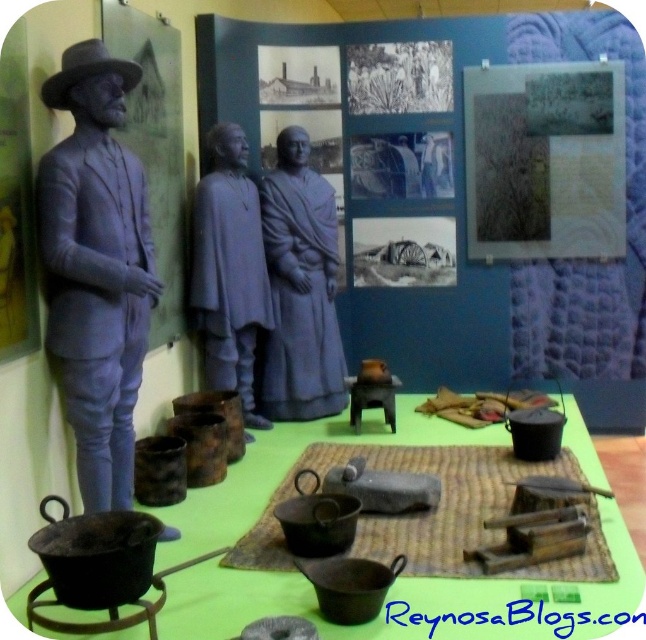
Does matte gray statue at left have a greater height compared to gray matte statue at center?

No.

Describe the element at coordinates (96, 268) in the screenshot. I see `matte gray statue at left` at that location.

At what (x,y) coordinates should I click in order to perform the action: click on matte gray statue at left. Please return your answer as a coordinate pair (x, y). Looking at the image, I should click on (96, 268).

Which is in front, point (275, 272) or point (214, 227)?

Point (214, 227)

Can you confirm if gray matte statue at center is bigger than gray matte statues at center?

No, gray matte statue at center is not bigger than gray matte statues at center.

Between point (284, 273) and point (222, 292), which one is positioned behind?

The point (284, 273) is more distant.

Identify the location of gray matte statue at center. This screenshot has height=640, width=646. (300, 289).

Between point (266, 548) and point (216, 225), which one is positioned in front?

Point (266, 548) is in front.

Between woven mat at center and gray matte statues at center, which one has more height?

Standing taller between the two is gray matte statues at center.

Is point (594, 531) farther from camera compared to point (256, 218)?

That is False.

You are a GUI agent. You are given a task and a screenshot of the screen. Output one action in this format:
    pyautogui.click(x=<x>, y=<y>)
    Task: Click on the woven mat at center
    This screenshot has height=640, width=646.
    Given the screenshot: What is the action you would take?
    pyautogui.click(x=412, y=513)